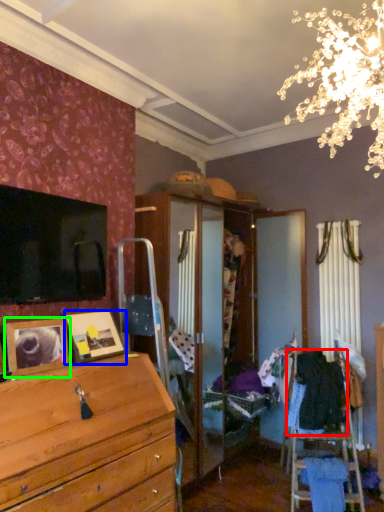
Question: Estimate the real-world distances between objects in this image. Which object is closer to clothing (highlighted by a red box), picture frame (highlighted by a blue box) or picture frame (highlighted by a green box)?

Choices:
 (A) picture frame
 (B) picture frame

Answer: (A)